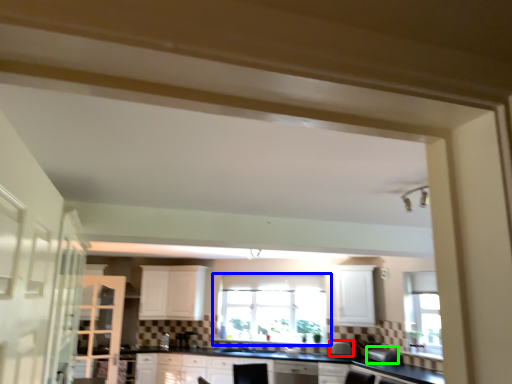
Question: Which is farther away from appliance (highlighted by a red box)? window (highlighted by a blue box) or appliance (highlighted by a green box)?

Choices:
 (A) window
 (B) appliance

Answer: (A)